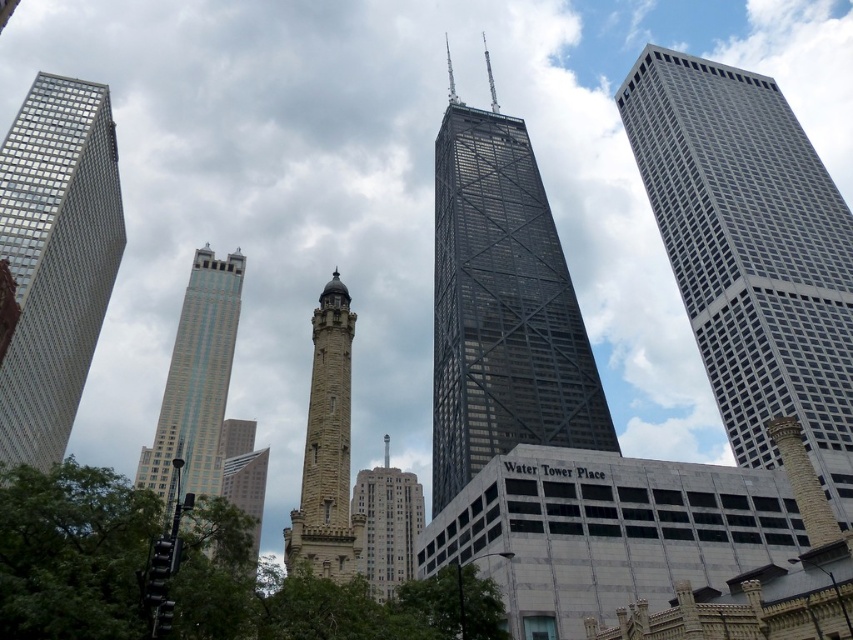
Does metallic grid skyscraper at right appear over matte glass skyscraper at left?

Yes.

Can you confirm if metallic grid skyscraper at right is positioned below matte glass skyscraper at left?

No.

Which is behind, point (747, 131) or point (59, 102)?

The point (747, 131) is behind.

At what (x,y) coordinates should I click in order to perform the action: click on metallic grid skyscraper at right. Please return your answer as a coordinate pair (x, y). The height and width of the screenshot is (640, 853). Looking at the image, I should click on (751, 253).

Is black glass skyscraper at center thinner than matte glass skyscraper at left?

Incorrect, black glass skyscraper at center's width is not less than matte glass skyscraper at left's.

Which is more to the left, black glass skyscraper at center or matte glass skyscraper at left?

From the viewer's perspective, matte glass skyscraper at left appears more on the left side.

Is point (492, 288) positioned before point (109, 129)?

Yes, point (492, 288) is in front of point (109, 129).

Where is `black glass skyscraper at center`? black glass skyscraper at center is located at coordinates (502, 305).

Does black glass skyscraper at center have a greater width compared to blue glass skyscraper at center-left?

Incorrect, black glass skyscraper at center's width does not surpass blue glass skyscraper at center-left's.

Is point (463, 177) positioned behind point (151, 490)?

Yes, it is behind point (151, 490).

Identify the location of black glass skyscraper at center. The width and height of the screenshot is (853, 640). (502, 305).